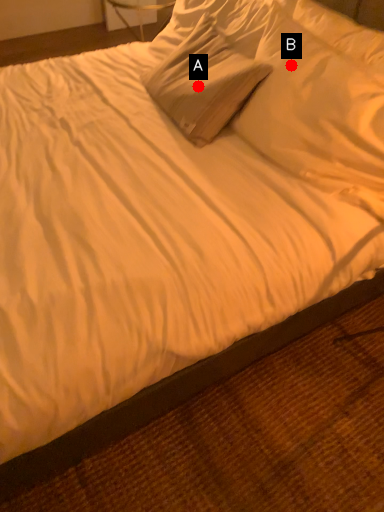
Question: Two points are circled on the image, labeled by A and B beside each circle. Which of the following is the closest to the observer?

Choices:
 (A) A is closer
 (B) B is closer

Answer: (B)